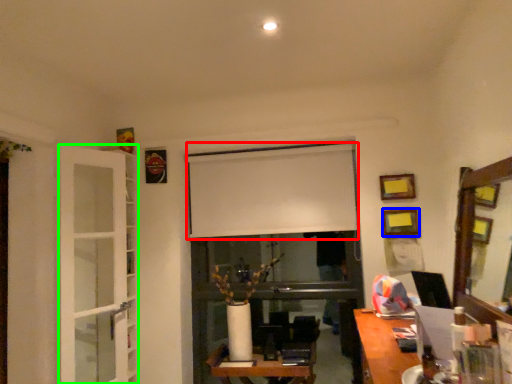
Question: Considering the real-world distances, which object is closest to window screen (highlighted by a red box)? picture frame (highlighted by a blue box) or glass door (highlighted by a green box).

Choices:
 (A) picture frame
 (B) glass door

Answer: (A)